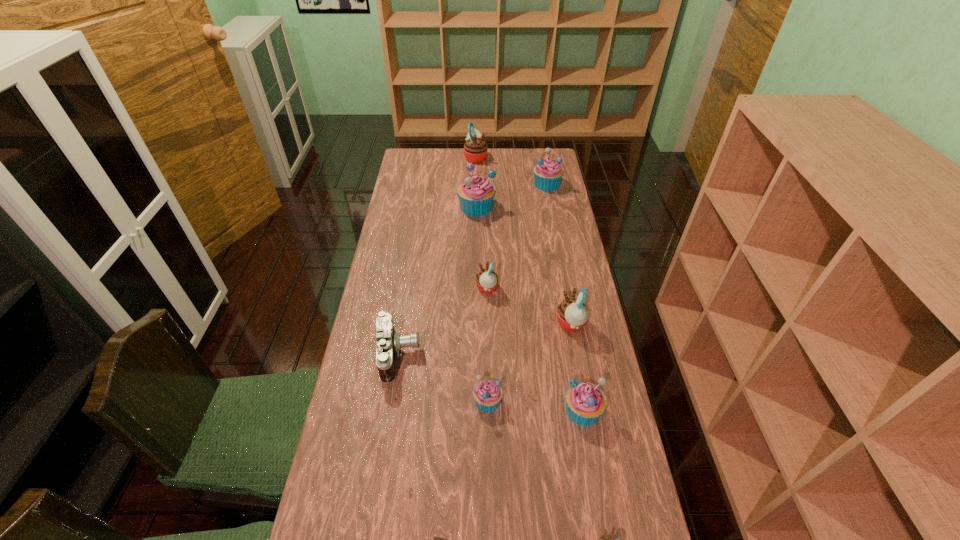
Where is `the biggest pink muffin`? the biggest pink muffin is located at coordinates (475, 149).

Identify the location of the farthest muffin. Image resolution: width=960 pixels, height=540 pixels. (475, 149).

Identify the location of the sixth nearest muffin. The image size is (960, 540). (475, 193).

Where is `the biggest blue muffin`? the biggest blue muffin is located at coordinates pos(475,193).

You are a GUI agent. You are given a task and a screenshot of the screen. Output one action in this format:
    pyautogui.click(x=<x>, y=<y>)
    Task: Click on the seventh nearest muffin
    This screenshot has width=960, height=540.
    Given the screenshot: What is the action you would take?
    pyautogui.click(x=547, y=173)

Locate an element on the screen. The image size is (960, 540). the third smallest blue muffin is located at coordinates (547, 173).

What are the coordinates of `the second biggest pink muffin` in the screenshot? It's located at (572, 315).

What are the coordinates of `the second nearest pink muffin` in the screenshot? It's located at (572, 315).

Locate an element on the screen. The image size is (960, 540). the third biggest blue muffin is located at coordinates (585, 402).

Where is `the second farthest pink muffin`? This screenshot has width=960, height=540. the second farthest pink muffin is located at coordinates (486, 280).